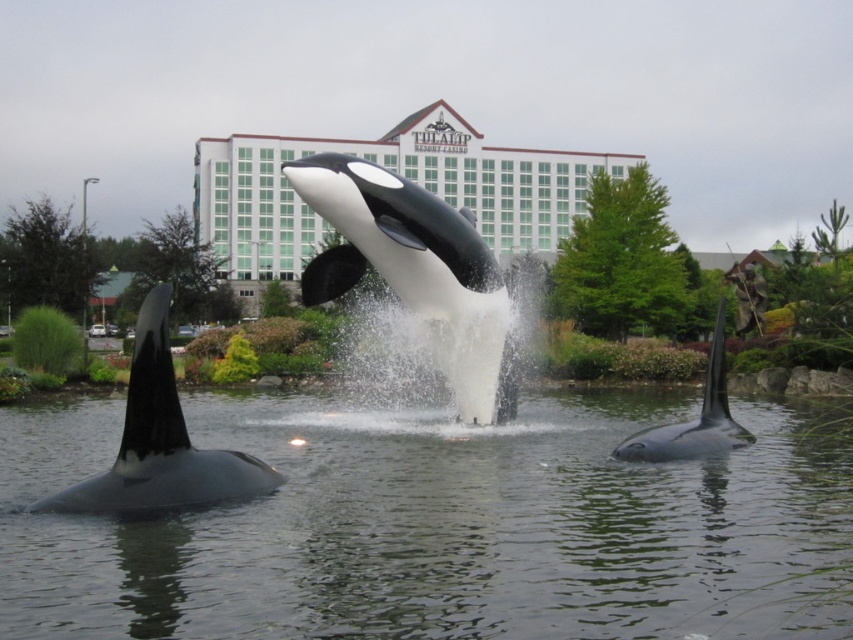
You are a photographer trying to capture the tallest orca in the image. Which one should you focus on between the black matte orca at left and the black matte orca at right?

The black matte orca at right is taller than the black matte orca at left, so you should focus on the black matte orca at right to capture the tallest one.

You are a visitor at the Tulalip Resort Casino and notice the black and white plastic orca at center and the clear water at center. Which object is taller in this scene?

The black and white plastic orca at center is taller than the clear water at center.

From the picture: You are standing in front of the orca whale sculptures at the Tulalip Resort Casino. You notice two points marked in the scene. The first point is at coordinates point (442, 214), and the second is at point (131, 499). Which point is closer to you?

Point (442, 214) is closer to you because it is further to the viewer than point (131, 499).